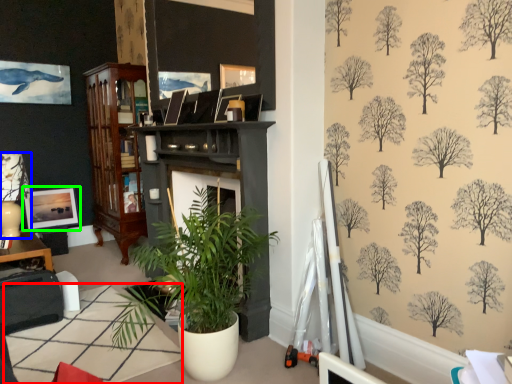
Question: Based on their relative distances, which object is farther from table (highlighted by a red box)? Choose from lamp (highlighted by a blue box) and picture frame (highlighted by a green box).

Choices:
 (A) lamp
 (B) picture frame

Answer: (B)